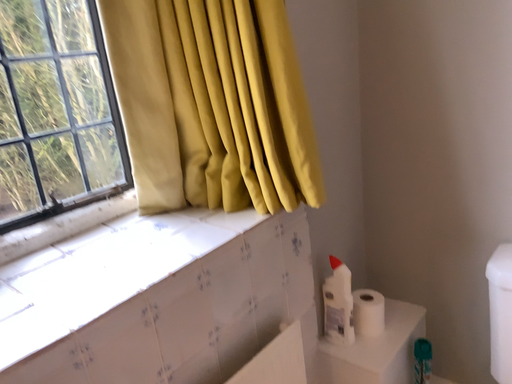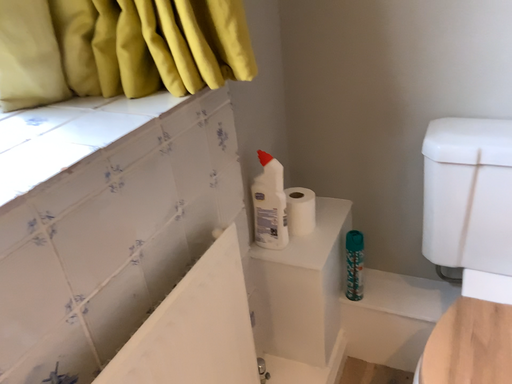
Question: How did the camera likely rotate when shooting the video?

Choices:
 (A) rotated left
 (B) rotated right

Answer: (B)